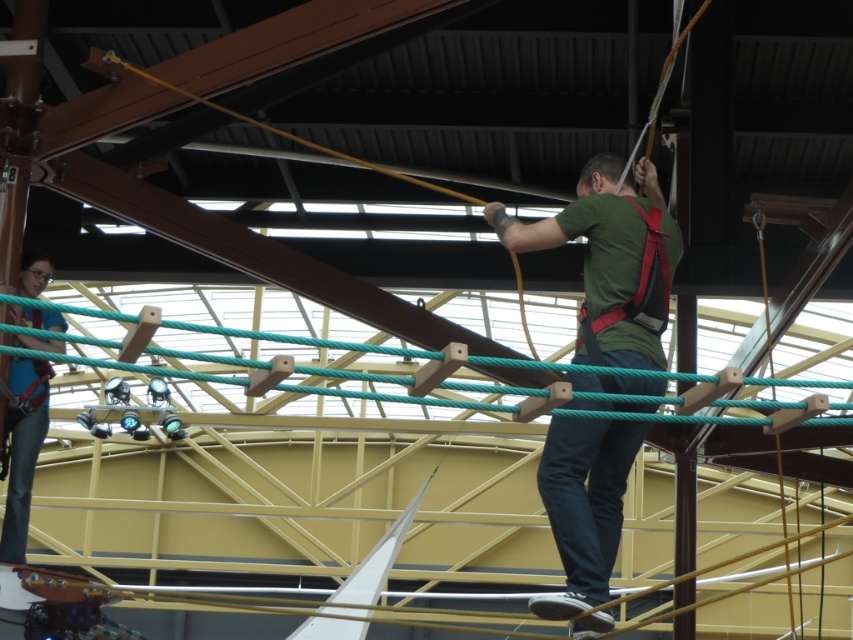
Question: Among these points, which one is nearest to the camera?

Choices:
 (A) (608, 552)
 (B) (33, 397)

Answer: (A)

Question: Can you confirm if green matte shirt at center is positioned above denim pants at lower left?

Choices:
 (A) yes
 (B) no

Answer: (A)

Question: Does green matte shirt at center appear on the left side of denim pants at lower left?

Choices:
 (A) yes
 (B) no

Answer: (B)

Question: Does green matte shirt at center appear under denim pants at lower left?

Choices:
 (A) no
 (B) yes

Answer: (A)